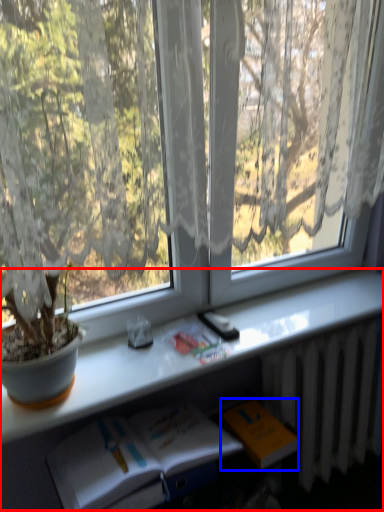
Question: Which object appears farthest to the camera in this image, computer desk (highlighted by a red box) or paperback book (highlighted by a blue box)?

Choices:
 (A) computer desk
 (B) paperback book

Answer: (B)